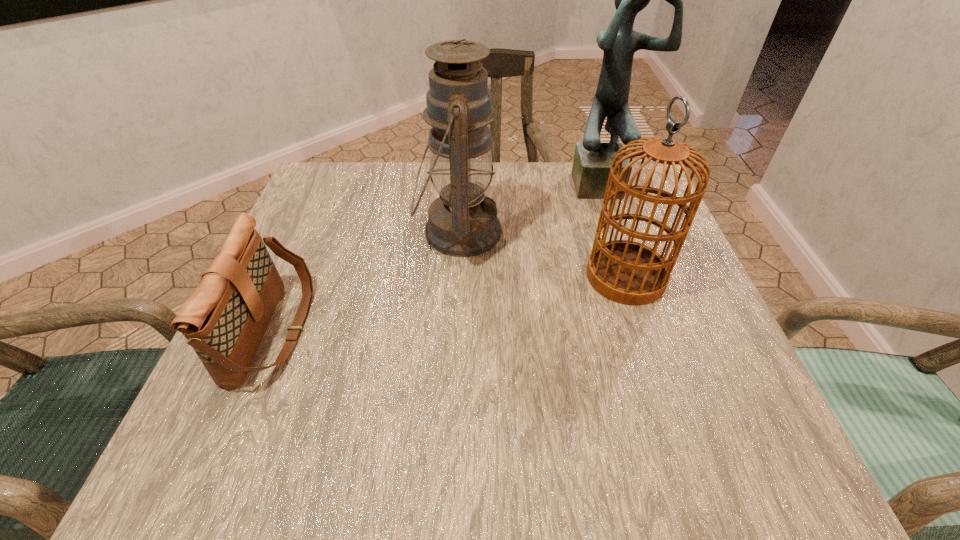
The image size is (960, 540). Find the location of `oil lamp present at the far edge`. oil lamp present at the far edge is located at coordinates (463, 222).

Locate an element on the screen. The height and width of the screenshot is (540, 960). object located at the left edge is located at coordinates (224, 319).

At what (x,y) coordinates should I click in order to perform the action: click on sculpture situated at the right edge. Please return your answer as a coordinate pair (x, y). Looking at the image, I should click on pyautogui.click(x=592, y=161).

Identify the location of birdcage at the right edge. The height and width of the screenshot is (540, 960). (627, 272).

Where is `object that is at the far right corner`? This screenshot has width=960, height=540. object that is at the far right corner is located at coordinates (592, 161).

In order to click on vacant space at the far edge of the desktop in this screenshot , I will do (x=384, y=168).

In the image, there is a desktop. Where is `free region at the near edge`? free region at the near edge is located at coordinates (578, 441).

You are a GUI agent. You are given a task and a screenshot of the screen. Output one action in this format:
    pyautogui.click(x=<x>, y=<y>)
    Task: Click on the free space at the left edge
    The image size is (960, 540).
    Given the screenshot: What is the action you would take?
    pyautogui.click(x=301, y=231)

This screenshot has height=540, width=960. I want to click on vacant space at the right edge of the desktop, so click(x=721, y=409).

Image resolution: width=960 pixels, height=540 pixels. In the image, there is a desktop. In order to click on vacant space at the far left corner in this screenshot , I will do [x=370, y=197].